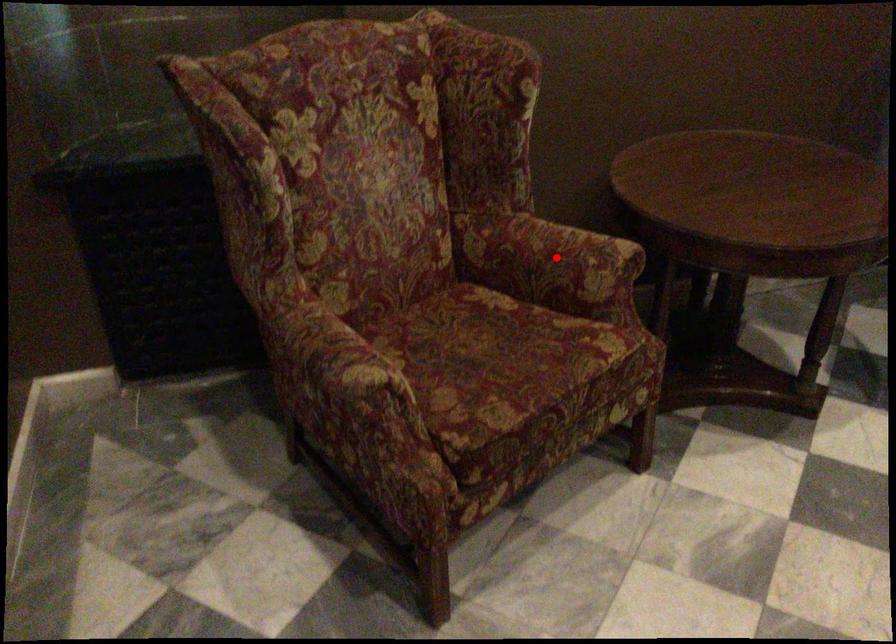
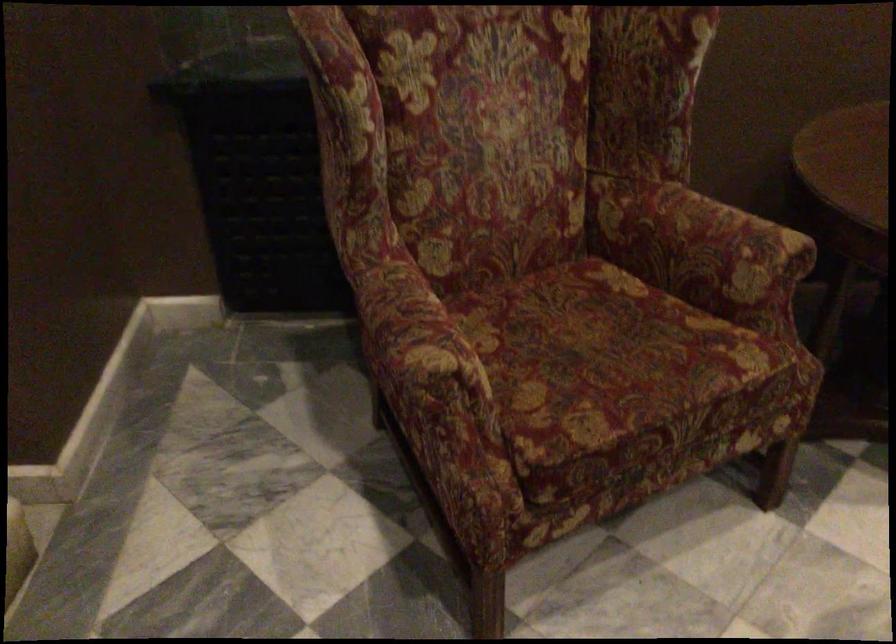
Question: I am providing you with two images of the same scene from different viewpoints. Given a red point in image1, look at the same physical point in image2. Is it:

Choices:
 (A) Closer to the viewpoint
 (B) Farther from the viewpoint

Answer: (A)